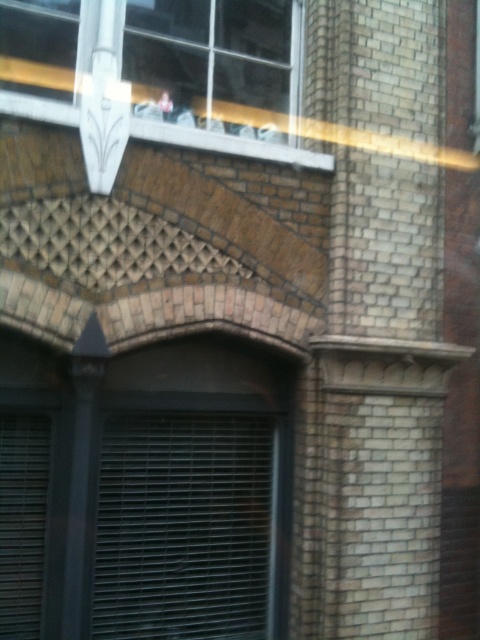
Can you confirm if clear glass window at upper center is positioned to the right of white textured stone at upper center?

Correct, you'll find clear glass window at upper center to the right of white textured stone at upper center.

Which is more to the right, clear glass window at upper center or white textured stone at upper center?

From the viewer's perspective, clear glass window at upper center appears more on the right side.

What do you see at coordinates (213, 64) in the screenshot? I see `clear glass window at upper center` at bounding box center [213, 64].

Image resolution: width=480 pixels, height=640 pixels. I want to click on clear glass window at upper center, so click(x=213, y=64).